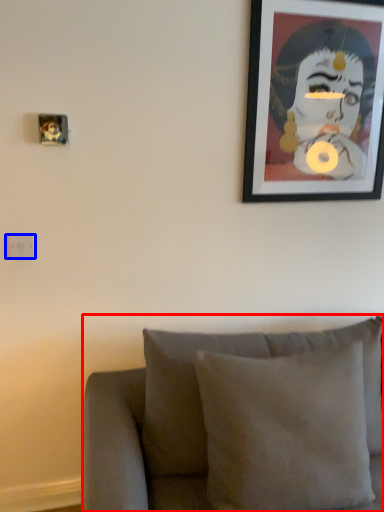
Question: Among these objects, which one is nearest to the camera, furniture (highlighted by a red box) or electric outlet (highlighted by a blue box)?

Choices:
 (A) furniture
 (B) electric outlet

Answer: (A)